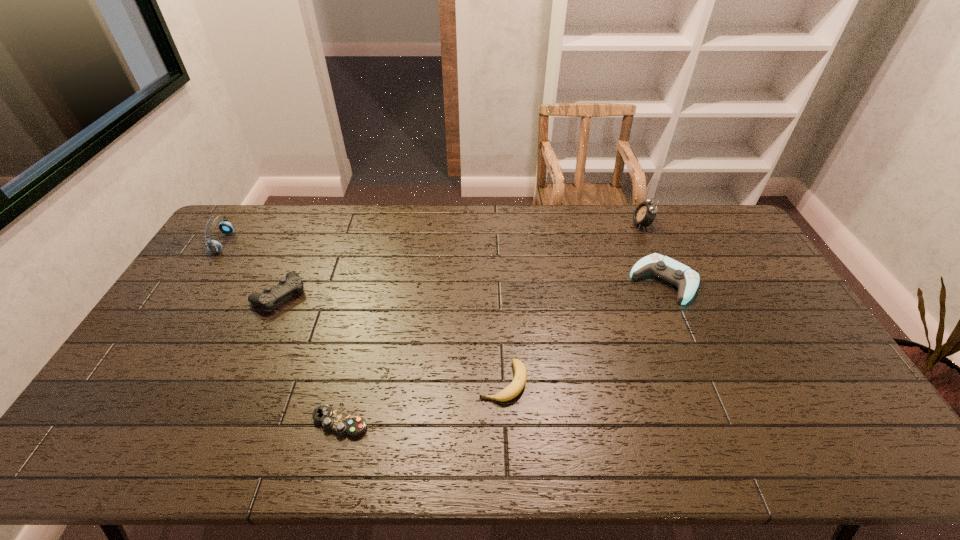
Identify the location of vacant area that satisfies the following two spatial constraints: 1. on the ear cups of the leftmost object; 2. on the right side of the banana. (132, 382).

Where is `blank space that satisfies the following two spatial constraints: 1. on the back side of the rightmost control; 2. on the right side of the shortest control`? The image size is (960, 540). blank space that satisfies the following two spatial constraints: 1. on the back side of the rightmost control; 2. on the right side of the shortest control is located at coordinates (374, 282).

This screenshot has width=960, height=540. What are the coordinates of `free spot that satisfies the following two spatial constraints: 1. on the back side of the rightmost control; 2. on the left side of the fifth farthest object` in the screenshot? It's located at (498, 282).

What are the coordinates of `free spot that satisfies the following two spatial constraints: 1. on the ear cups of the headset; 2. on the left side of the leftmost control` in the screenshot? It's located at [189, 295].

Find the location of a particular element. blank space that satisfies the following two spatial constraints: 1. on the ear cups of the banana; 2. on the right side of the leftmost object is located at coordinates (132, 382).

At what (x,y) coordinates should I click in order to perform the action: click on blank area in the image that satisfies the following two spatial constraints: 1. on the ear cups of the rightmost control; 2. on the left side of the headset. Please return your answer as a coordinate pair (x, y). This screenshot has height=540, width=960. Looking at the image, I should click on (198, 282).

I want to click on vacant space that satisfies the following two spatial constraints: 1. on the ear cups of the second control from right to left; 2. on the right side of the headset, so click(x=106, y=423).

You are a GUI agent. You are given a task and a screenshot of the screen. Output one action in this format:
    pyautogui.click(x=<x>, y=<y>)
    Task: Click on the free spot that satisfies the following two spatial constraints: 1. on the ear cups of the second control from left to right; 2. on the right side of the leftmost object
    This screenshot has height=540, width=960.
    Given the screenshot: What is the action you would take?
    pyautogui.click(x=106, y=423)